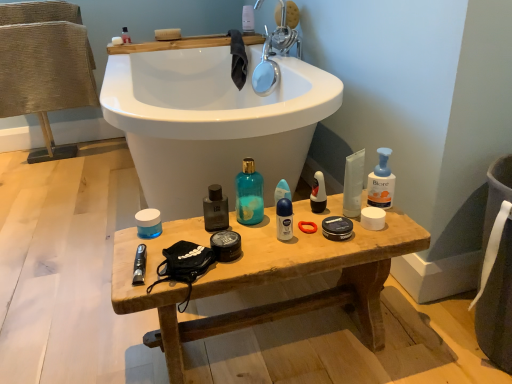
Where is `vacant space in front of blue pump bottle at right, which is the first cleaning product in right-to-left order`? This screenshot has height=384, width=512. vacant space in front of blue pump bottle at right, which is the first cleaning product in right-to-left order is located at coordinates (379, 229).